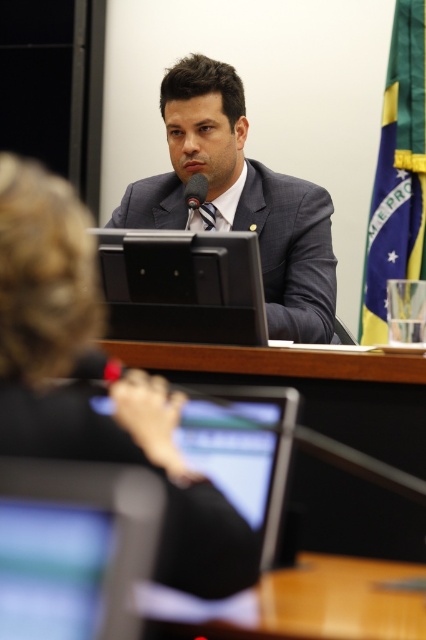
The width and height of the screenshot is (426, 640). Describe the element at coordinates (74, 547) in the screenshot. I see `matte black monitor at lower left` at that location.

Between point (9, 500) and point (394, 596), which one is positioned in front?

Point (9, 500)

Does point (127, 609) lie in front of point (423, 634)?

Yes, it is.

Where is `matte black monitor at lower left`? matte black monitor at lower left is located at coordinates (74, 547).

Can you confirm if black fabric jacket at upper center is positioned to the right of black plastic laptop at center?

No, black fabric jacket at upper center is not to the right of black plastic laptop at center.

Is black fabric jacket at upper center further to camera compared to black plastic laptop at center?

No, it is in front of black plastic laptop at center.

Is point (216, 520) farther from viewer compared to point (176, 257)?

No, (216, 520) is closer to viewer.

What are the coordinates of `black fabric jacket at upper center` in the screenshot? It's located at (109, 388).

Which of these two, matte black suit at center or matte black monitor at lower left, stands shorter?

matte black monitor at lower left

Who is more distant from viewer, (176, 88) or (138, 531)?

Positioned behind is point (176, 88).

Where is `matte black suit at center`? This screenshot has width=426, height=640. matte black suit at center is located at coordinates (239, 198).